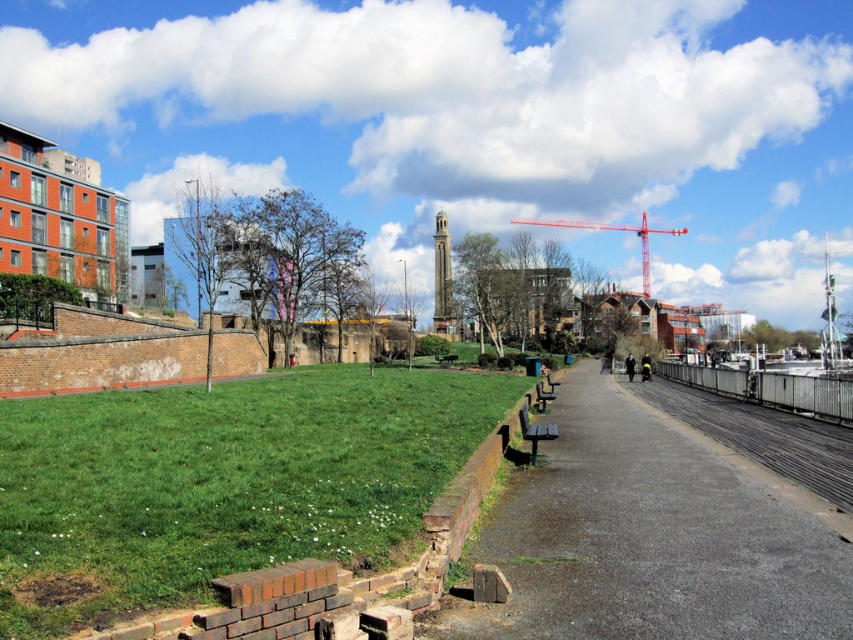
You are standing at the starting point of the park pathway and see two points marked in the scene. The first point is at coordinate point (3, 508) and the second is at point (740, 445). Which point is closer to you?

Point (3, 508) is in front of point (740, 445), so it is closer to you.

From the picture: You are standing at the center of the park and want to reach the green grass at lower left. Which direction should you move to reach it?

To reach the green grass at lower left, you should move towards the lower left direction from your current position at the center of the park.